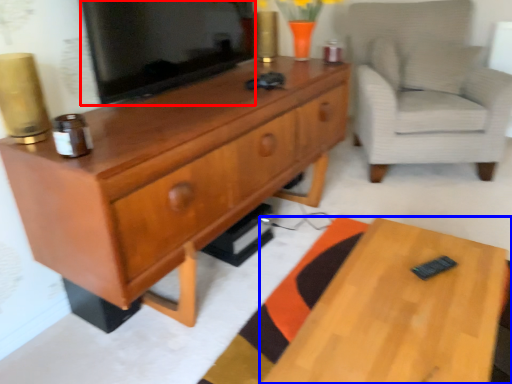
Question: Which object is closer to the camera taking this photo, television (highlighted by a red box) or desk (highlighted by a blue box)?

Choices:
 (A) television
 (B) desk

Answer: (B)